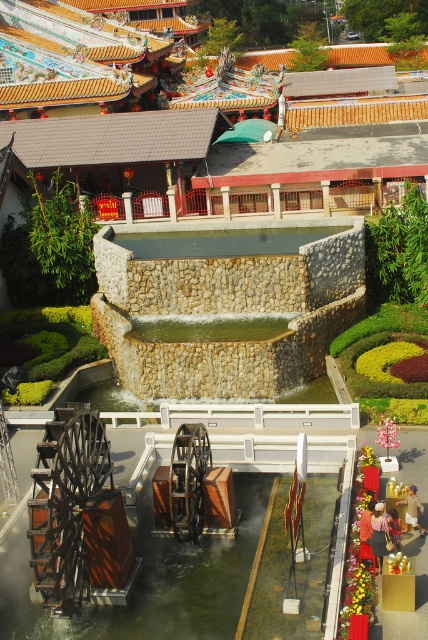
You are standing at the point marked as point (112, 64) in the image. What object are you directly facing?

You are directly facing the matte brown temple at upper center as that point corresponds to it.

You are a visitor standing at the edge of the stone textured fountain at center and want to take a photo of the wooden waterwheel at lower center. Since the fountain is in front, will you need to move forward or backward to capture the waterwheel without the fountain blocking the view?

The stone textured fountain at center is taller than the wooden waterwheel at lower center. To avoid the fountain blocking the view, you should move backward to get a better angle where the fountain doesn